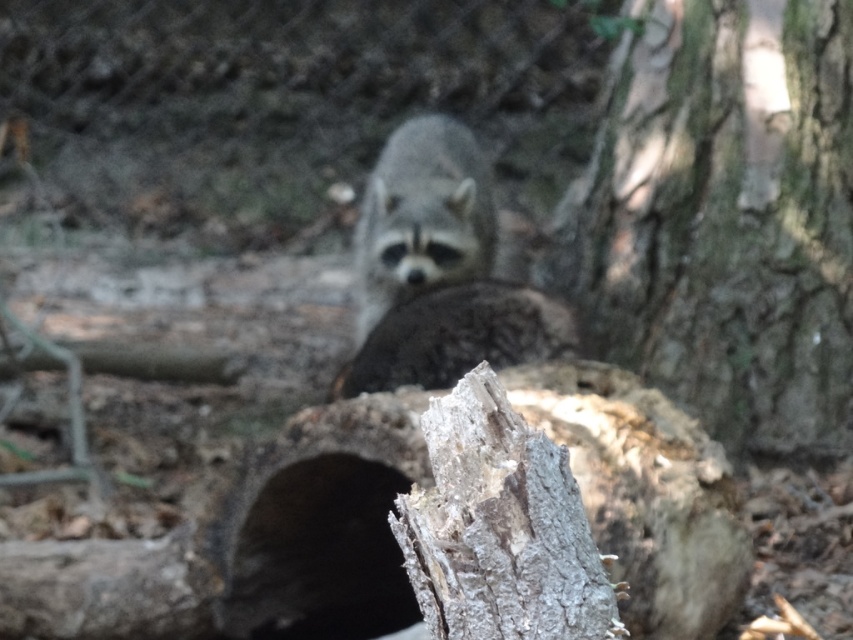
You are standing in a forest and see the black matte hole at center. If you want to reach it, how many steps would you estimate you need to take, assuming each step covers about 0.75 meters?

The black matte hole at center is 3.46 meters away from the viewer. Since each step covers about 0.75 meters, you would need approximately 5 steps to reach it.

You are a hiker in the forest and you see the rough bark tree at center right and the fuzzy gray raccoon at center. Which object is bigger in size?

The rough bark tree at center right is larger in size than the fuzzy gray raccoon at center, so the rough bark tree at center right is bigger.